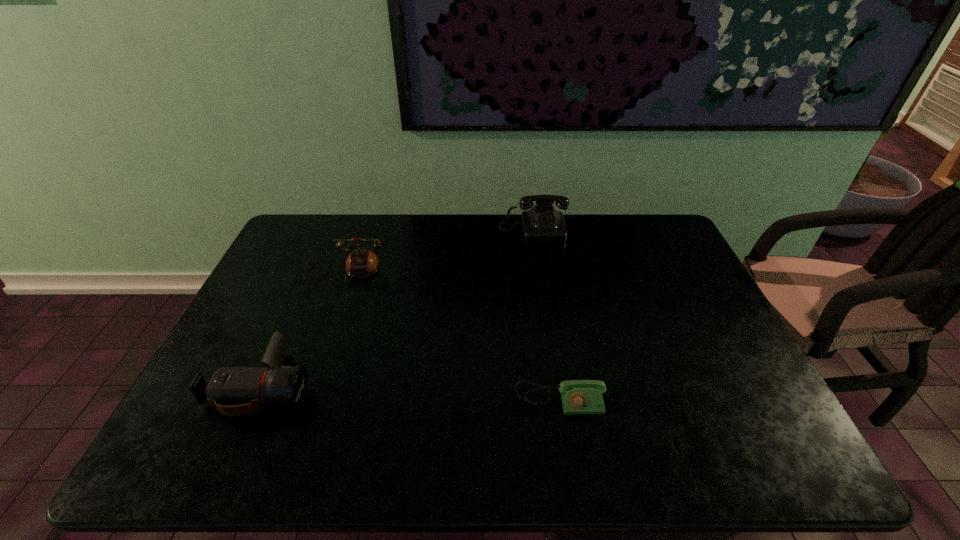
What are the coordinates of `free space between the farthest telephone and the third nearest object` in the screenshot? It's located at (437, 250).

What are the coordinates of `vacant space that is in between the second farthest telephone and the farthest object` in the screenshot? It's located at (437, 250).

In order to click on free space between the second farthest object and the farthest telephone in this screenshot , I will do `click(437, 250)`.

At what (x,y) coordinates should I click in order to perform the action: click on free spot between the shortest object and the leftmost telephone. Please return your answer as a coordinate pair (x, y). Looking at the image, I should click on (450, 335).

Locate an element on the screen. The height and width of the screenshot is (540, 960). free spot between the nearest telephone and the second shortest object is located at coordinates (411, 393).

Identify the location of blank region between the second farthest telephone and the shortest telephone. (450, 335).

I want to click on free space between the farthest object and the leftmost telephone, so click(437, 250).

Identify the location of object that is the closest to the leftmost telephone. (235, 391).

You are a GUI agent. You are given a task and a screenshot of the screen. Output one action in this format:
    pyautogui.click(x=<x>, y=<y>)
    Task: Click on the object that is the closest to the leftmost telephone
    
    Given the screenshot: What is the action you would take?
    pyautogui.click(x=235, y=391)

Identify which telephone is the closest to the third tallest object. Please provide its 2D coordinates. Your answer should be formatted as a tuple, i.e. [(x, y)], where the tuple contains the x and y coordinates of a point satisfying the conditions above.

[(361, 262)]